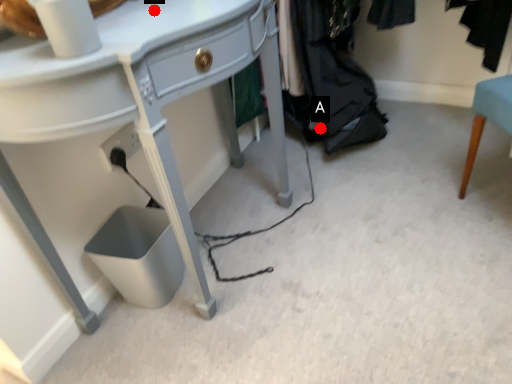
Question: Two points are circled on the image, labeled by A and B beside each circle. Which point is farther from the camera taking this photo?

Choices:
 (A) A is further
 (B) B is further

Answer: (A)